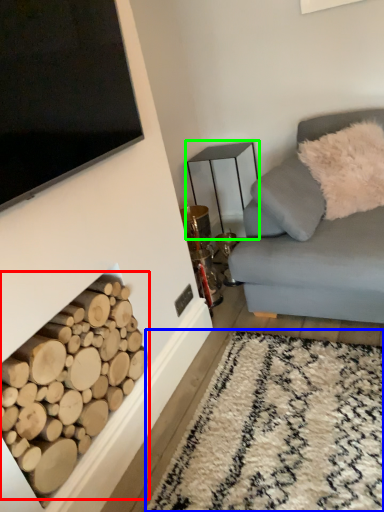
Question: Which is nearer to the driftwood (highlighted by a red box)? plain (highlighted by a blue box) or table (highlighted by a green box).

Choices:
 (A) plain
 (B) table

Answer: (A)